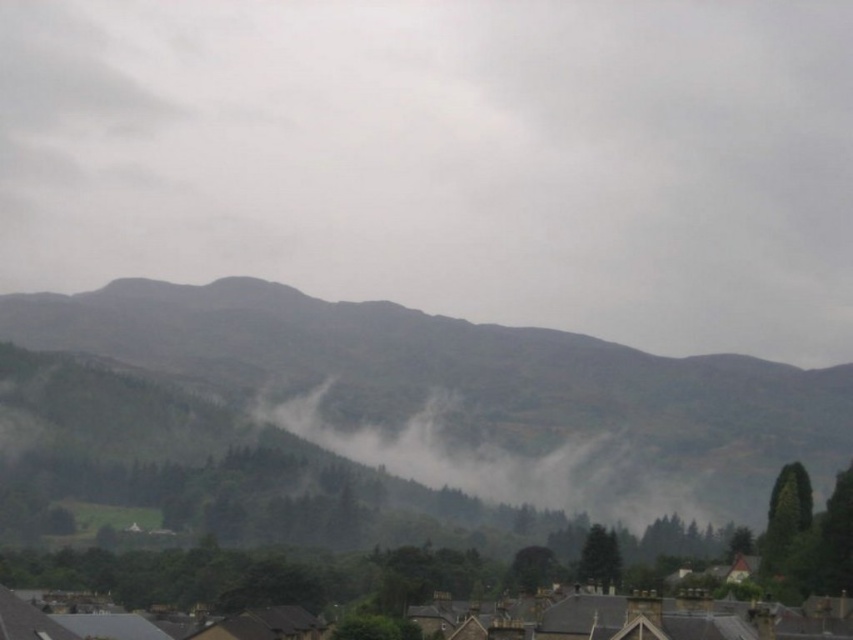
Question: Does gray foggy cloud at upper center appear under foggy misty valley at center?

Choices:
 (A) no
 (B) yes

Answer: (A)

Question: Among these objects, which one is farthest from the camera?

Choices:
 (A) gray foggy cloud at upper center
 (B) green textured hillside at center
 (C) foggy misty valley at center
 (D) brown stone rooftops at bottom

Answer: (A)

Question: Is gray foggy cloud at upper center closer to camera compared to green textured hillside at center?

Choices:
 (A) no
 (B) yes

Answer: (A)

Question: Which object is positioned closest to the brown stone rooftops at bottom?

Choices:
 (A) green textured hillside at center
 (B) foggy misty valley at center
 (C) gray foggy cloud at upper center

Answer: (B)

Question: Observing the image, what is the correct spatial positioning of gray foggy cloud at upper center in reference to brown stone rooftops at bottom?

Choices:
 (A) left
 (B) right

Answer: (B)

Question: Estimate the real-world distances between objects in this image. Which object is farther from the foggy misty valley at center?

Choices:
 (A) green textured hillside at center
 (B) brown stone rooftops at bottom
 (C) gray foggy cloud at upper center

Answer: (C)